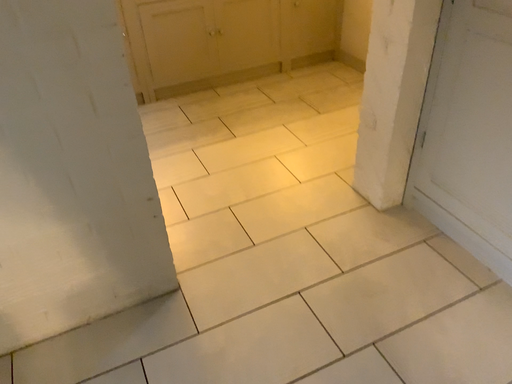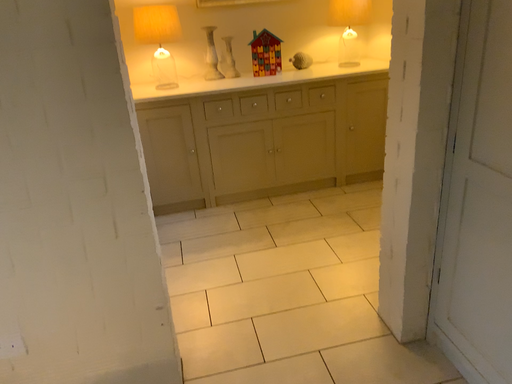
Question: How did the camera likely rotate when shooting the video?

Choices:
 (A) rotated upward
 (B) rotated downward

Answer: (A)